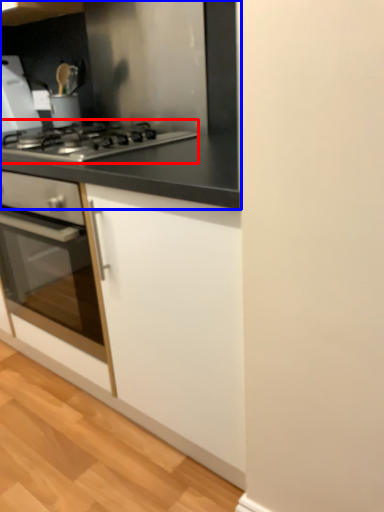
Question: Which object is closer to the camera taking this photo, gas stove (highlighted by a red box) or countertop (highlighted by a blue box)?

Choices:
 (A) gas stove
 (B) countertop

Answer: (A)